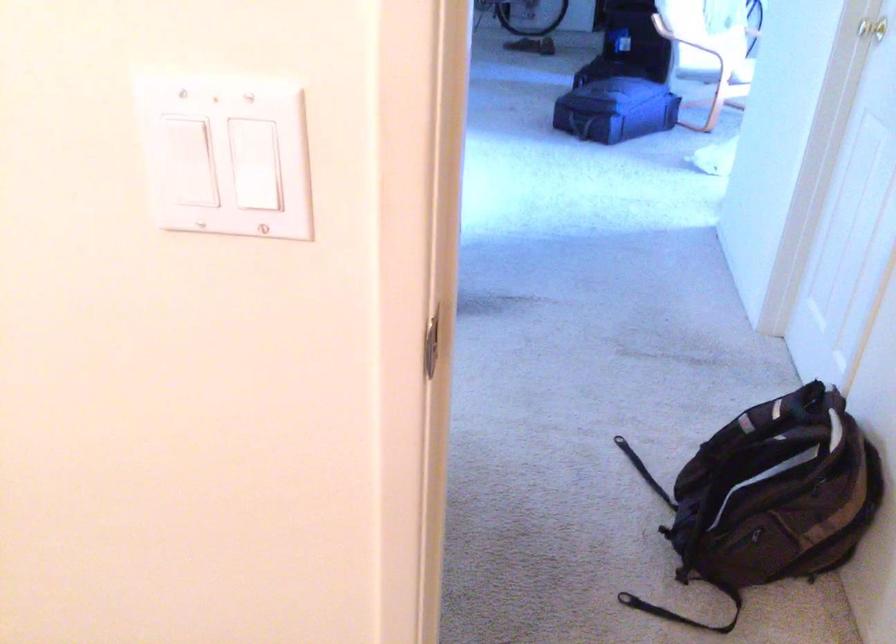
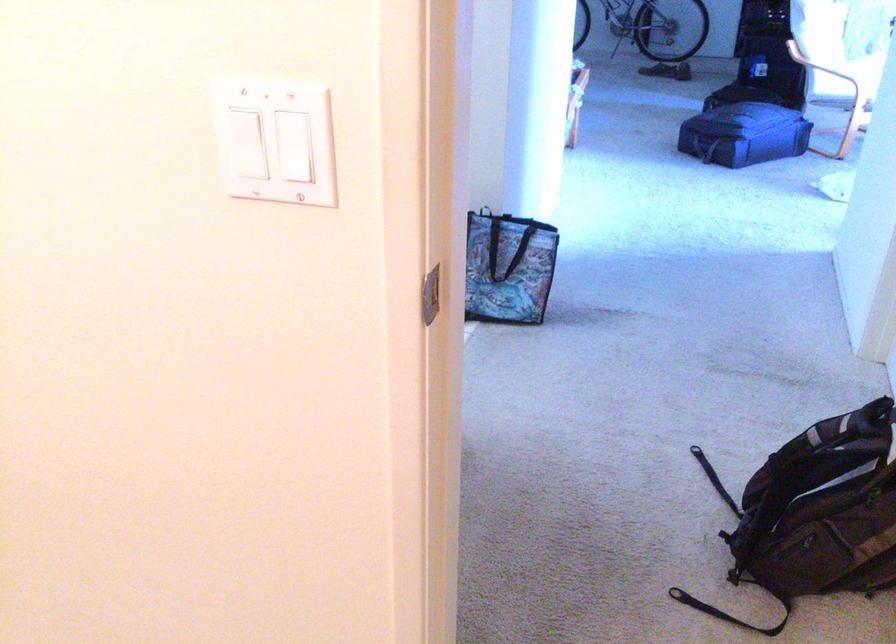
Find the pixel in the second image that matches (x=771, y=516) in the first image.

(826, 516)